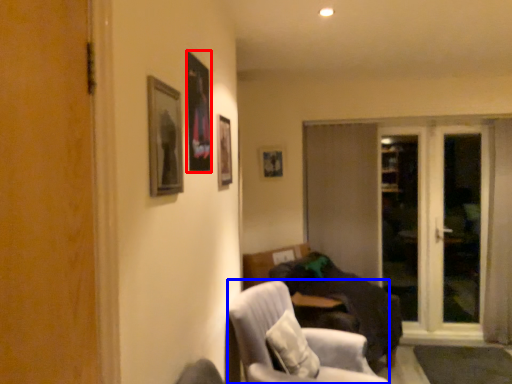
Question: Which object is closer to the camera taking this photo, picture frame (highlighted by a red box) or chair (highlighted by a blue box)?

Choices:
 (A) picture frame
 (B) chair

Answer: (A)